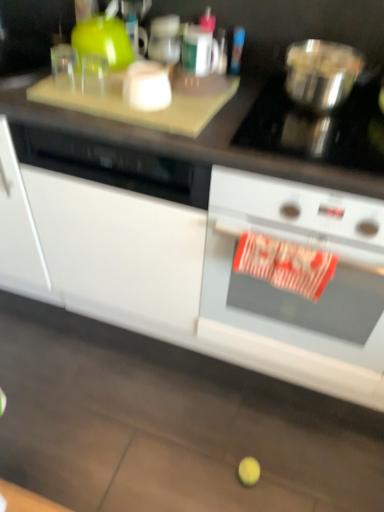
Question: From a real-world perspective, is metallic silver bowl at upper right located higher than white matte cabinet at lower center?

Choices:
 (A) yes
 (B) no

Answer: (A)

Question: Is metallic silver bowl at upper right placed right next to white matte cabinet at lower center?

Choices:
 (A) yes
 (B) no

Answer: (B)

Question: Is metallic silver bowl at upper right facing towards white matte cabinet at lower center?

Choices:
 (A) yes
 (B) no

Answer: (B)

Question: Is metallic silver bowl at upper right positioned in front of white matte cabinet at lower center?

Choices:
 (A) yes
 (B) no

Answer: (B)

Question: Is white matte cabinet at lower center inside metallic silver bowl at upper right?

Choices:
 (A) yes
 (B) no

Answer: (B)

Question: Is metallic silver bowl at upper right to the left or to the right of white matte cabinet at lower center in the image?

Choices:
 (A) left
 (B) right

Answer: (B)

Question: From a real-world perspective, is metallic silver bowl at upper right above or below white matte cabinet at lower center?

Choices:
 (A) below
 (B) above

Answer: (B)

Question: From the image's perspective, relative to white matte cabinet at lower center, is metallic silver bowl at upper right above or below?

Choices:
 (A) above
 (B) below

Answer: (A)

Question: Is point (319, 64) closer or farther from the camera than point (72, 237)?

Choices:
 (A) farther
 (B) closer

Answer: (B)

Question: Considering the relative positions of metallic silver bowl at upper right and white glossy oven at right in the image provided, is metallic silver bowl at upper right to the left or to the right of white glossy oven at right?

Choices:
 (A) right
 (B) left

Answer: (B)

Question: Is point (357, 66) positioned closer to the camera than point (317, 201)?

Choices:
 (A) farther
 (B) closer

Answer: (A)

Question: Do you think metallic silver bowl at upper right is within white glossy oven at right, or outside of it?

Choices:
 (A) inside
 (B) outside

Answer: (B)

Question: Is metallic silver bowl at upper right wider or thinner than white glossy oven at right?

Choices:
 (A) thin
 (B) wide

Answer: (A)

Question: Looking at their shapes, would you say white matte cabinet at lower center is wider or thinner than white glossy oven at right?

Choices:
 (A) wide
 (B) thin

Answer: (A)

Question: Is white matte cabinet at lower center bigger or smaller than white glossy oven at right?

Choices:
 (A) big
 (B) small

Answer: (A)